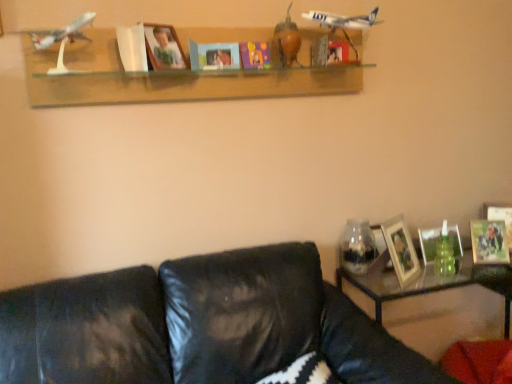
Question: From the image's perspective, is wooden photo frame at right, the second picture frame in the left-to-right sequence, positioned above or below matte purple paper at center, which ranks as the 1th paperback book in right-to-left order?

Choices:
 (A) below
 (B) above

Answer: (A)

Question: Considering their positions, is wooden photo frame at right, placed as the fourth picture frame when sorted from right to left, located in front of or behind matte purple paper at center, which ranks as the 1th paperback book in right-to-left order?

Choices:
 (A) front
 (B) behind

Answer: (A)

Question: Considering the real-world distances, which object is farthest from the matte purple paper at center, which is the third paperback book in left-to-right order?

Choices:
 (A) black textured pillow at lower center
 (B) wooden photo frame at right, placed as the fourth picture frame when sorted from right to left
 (C) white matte paperback book at upper center, the 1th paperback book viewed from the left
 (D) black leather couch at lower left
 (E) metallic silver photo frame at right, the 4th picture frame from the left

Answer: (E)

Question: Which is farther from the black textured pillow at lower center?

Choices:
 (A) transparent glass jar at right
 (B) metallic silver photo frame at right, the 4th picture frame from the left
 (C) white matte paperback book at upper center, the 3th paperback book from the right
 (D) wooden photo frame at upper center, the fifth picture frame from the bottom
 (E) wooden shelf at upper center

Answer: (C)